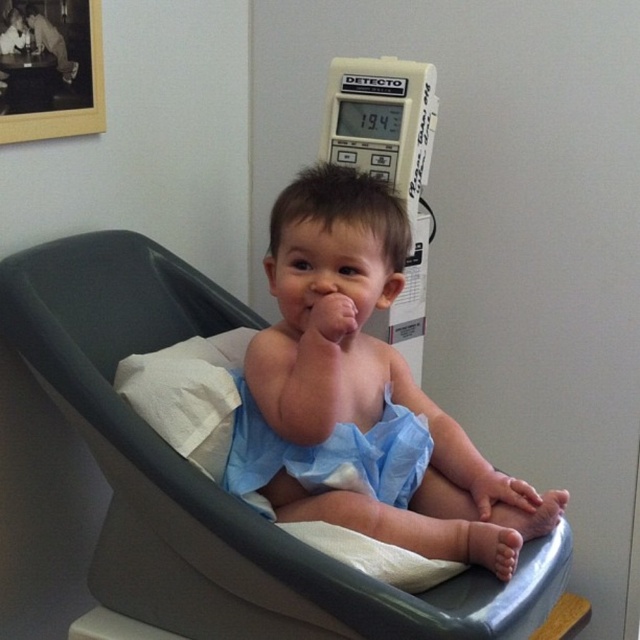
Question: Observing the image, what is the correct spatial positioning of blue fabric feeding chair at center in reference to light blue cloth diaper at center?

Choices:
 (A) left
 (B) right

Answer: (A)

Question: Considering the real-world distances, which object is closest to the blue fabric cloth at center?

Choices:
 (A) blue fabric feeding chair at center
 (B) light blue cloth diaper at center

Answer: (B)

Question: Among these objects, which one is nearest to the camera?

Choices:
 (A) light blue cloth diaper at center
 (B) blue fabric feeding chair at center
 (C) blue fabric cloth at center

Answer: (B)

Question: Is blue fabric feeding chair at center behind light blue cloth diaper at center?

Choices:
 (A) no
 (B) yes

Answer: (A)

Question: Estimate the real-world distances between objects in this image. Which object is farther from the light blue cloth diaper at center?

Choices:
 (A) blue fabric feeding chair at center
 (B) blue fabric cloth at center

Answer: (A)

Question: In this image, where is blue fabric feeding chair at center located relative to blue fabric cloth at center?

Choices:
 (A) below
 (B) above

Answer: (A)